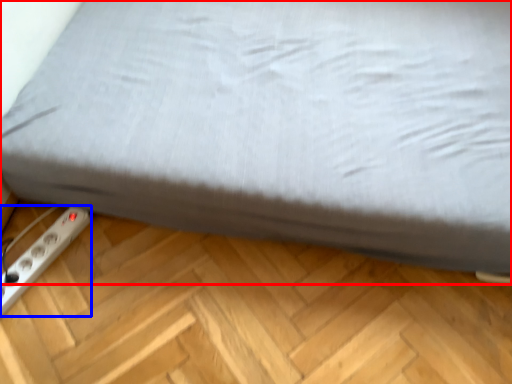
Question: Which of the following is the farthest to the observer, bed (highlighted by a red box) or power plugs and sockets (highlighted by a blue box)?

Choices:
 (A) bed
 (B) power plugs and sockets

Answer: (B)